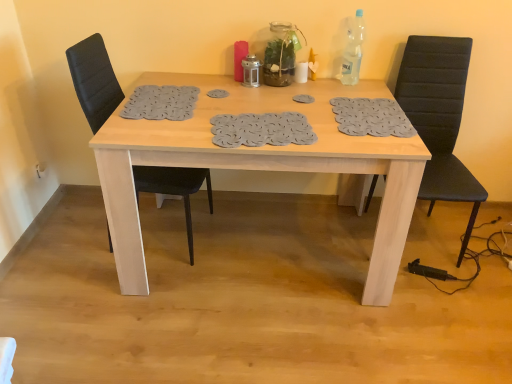
Find the location of a particular element. Image resolution: width=512 pixels, height=384 pixels. vacant space underneath light wood table at center (from a real-world perspective) is located at coordinates (273, 247).